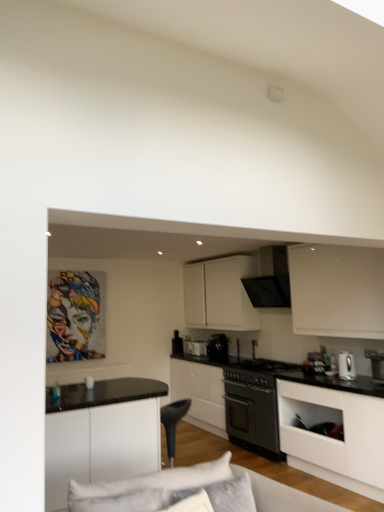
Question: Looking at the image, does black matte oven at center, positioned as the 4th appliance in left-to-right order, seem bigger or smaller compared to white matte cabinet at lower right, positioned as the 1th cabinetry in front-to-back order?

Choices:
 (A) big
 (B) small

Answer: (B)

Question: From their relative heights in the image, would you say black matte oven at center, placed as the second appliance when sorted from right to left, is taller or shorter than white matte cabinet at lower right, positioned as the 1th cabinetry in front-to-back order?

Choices:
 (A) tall
 (B) short

Answer: (B)

Question: Which is farther from the white matte cabinet at lower right, which appears as the 3th cabinetry when viewed from the back?

Choices:
 (A) black plastic swivel chair at center
 (B) black matte oven at center, the second cabinetry in the back-to-front sequence
 (C) black matte oven at center, placed as the second appliance when sorted from right to left
 (D) black matte exhaust hood at upper center
 (E) white glossy electric kettle at right

Answer: (B)

Question: Which object is the farthest from the black matte oven at center, the second cabinetry in the back-to-front sequence?

Choices:
 (A) soft gray fabric pillow at lower center
 (B) white glossy electric kettle at right
 (C) black glossy coffee maker at center, the 3th appliance viewed from the left
 (D) white glossy toaster at center, which is the fifth appliance from front to back
 (E) white fabric couch at lower center

Answer: (A)